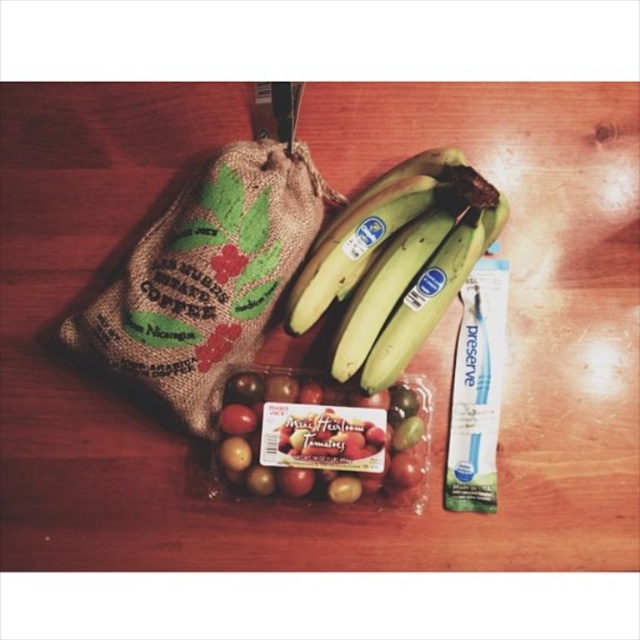
You are organizing items on a shelf and need to know the height of both the burlap coffee bag at upper left and the blue plastic toothpaste at center right. Which one is taller?

The burlap coffee bag at upper left is taller than the blue plastic toothpaste at center right.

You are standing in front of the grocery items on the wooden surface. There are two points marked on the image. Which point, point 1 at coordinates (332, 253) or point 2 at coordinates (301, 380), is closer to you?

Point 1 at coordinates (332, 253) is closer to you than point 2 at coordinates (301, 380).

You are standing in a kitchen and see the burlap coffee bag at upper left on the counter. If you want to grab it, will you need to lean forward or can you reach it easily?

The burlap coffee bag at upper left is 1.27 meters from the viewer, which is about 4 feet away. Since it is within arm reach, you can grab it without leaning forward.